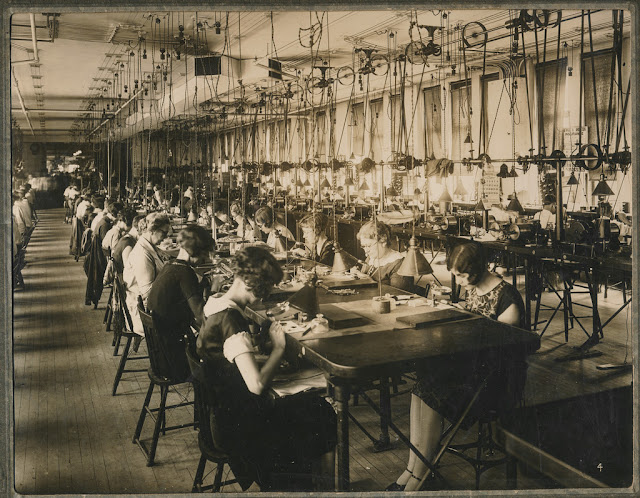
At what (x,y) coordinates should I click in order to perform the action: click on chair. Please return your answer as a coordinate pair (x, y). Looking at the image, I should click on (218, 376), (160, 354), (134, 316), (491, 459), (397, 393), (582, 294), (24, 265), (34, 241).